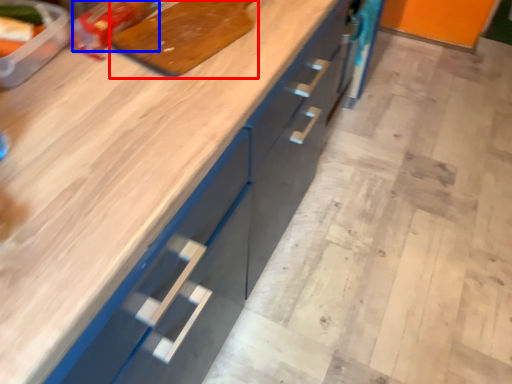
Question: Which object is closer to the camera taking this photo, cutting board (highlighted by a red box) or food (highlighted by a blue box)?

Choices:
 (A) cutting board
 (B) food

Answer: (A)